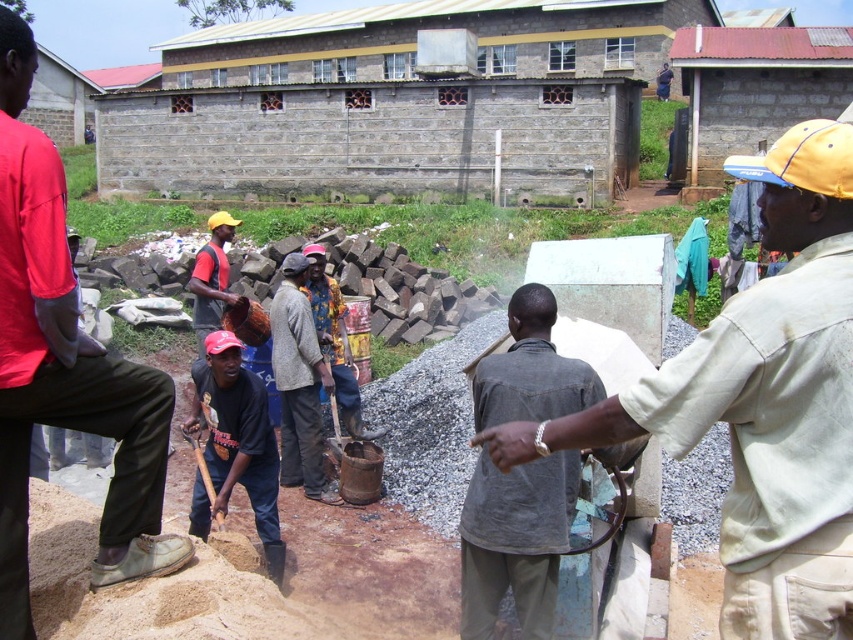
Consider the image. You are a construction worker standing at the edge of the site. You need to locate the light beige fabric shirt at center and the dark gray shirt at center. According to the scene, which one is positioned to the right of the other?

The light beige fabric shirt at center is to the right of dark gray shirt at center.

You are a drone operator tasked with capturing aerial footage of the construction site. You need to focus your camera on the light beige fabric shirt at center. What are the coordinates where you should direct your camera?

The light beige fabric shirt at center is located at point (761,401), so you should direct your camera to those coordinates to focus on it.

You are a safety inspector on the construction site. You need to ensure that workers are maintaining a safe distance of at least 2 meters apart for safety protocols. Are the red shirt at left and dark blue shirt at center following this guideline?

The distance between the red shirt at left and dark blue shirt at center is 1.79 meters, which is less than the required 2 meters. Therefore, they are not following the safety guideline.